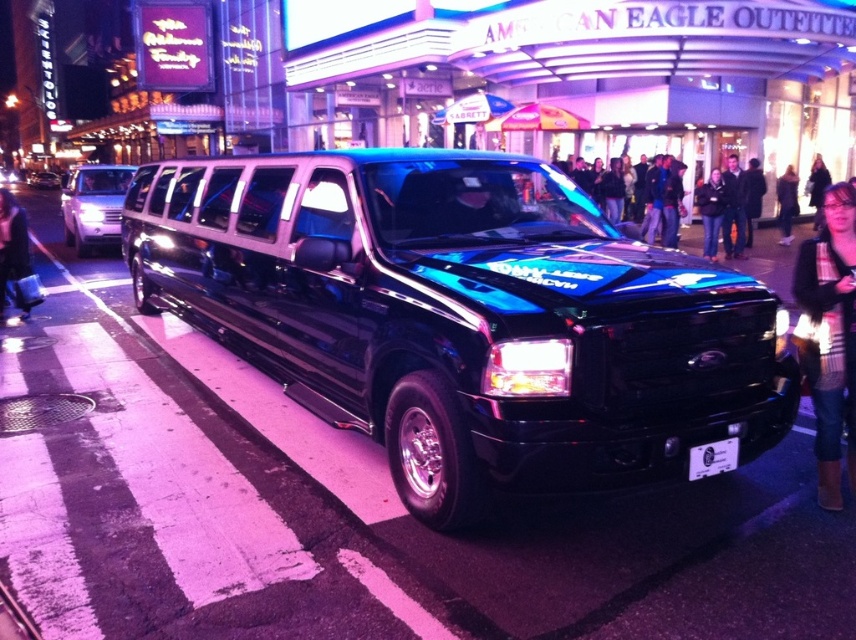
Question: Which point is closer to the camera taking this photo?

Choices:
 (A) (56, 179)
 (B) (565, 330)

Answer: (B)

Question: Which object appears closest to the camera in this image?

Choices:
 (A) metallic silver suv at left
 (B) shiny black limousine at center
 (C) white plastic license plate at center
 (D) striped sweater at lower right

Answer: (C)

Question: Does black glossy limousine at center come behind white plastic license plate at center?

Choices:
 (A) yes
 (B) no

Answer: (A)

Question: Does metallic blue car at center appear over white plastic license plate at center?

Choices:
 (A) yes
 (B) no

Answer: (A)

Question: Considering the relative positions of metallic blue car at center and shiny black limousine at center in the image provided, where is metallic blue car at center located with respect to shiny black limousine at center?

Choices:
 (A) below
 (B) above

Answer: (A)

Question: Which point is closer to the camera?

Choices:
 (A) white plastic license plate at center
 (B) black glossy limousine at center
 (C) shiny black limousine at center

Answer: (A)